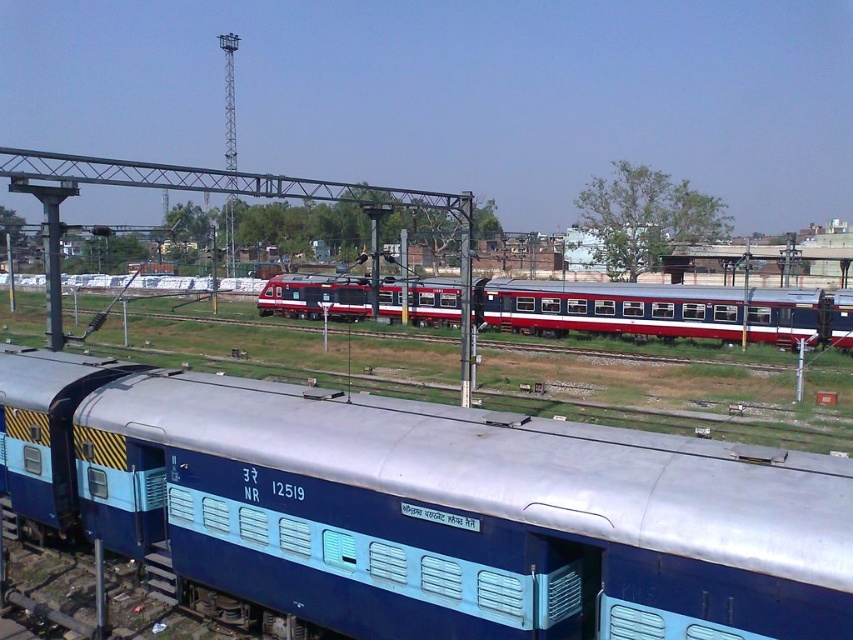
Question: Is blue metallic train car at lower left to the right of red glossy passenger train at center from the viewer's perspective?

Choices:
 (A) yes
 (B) no

Answer: (B)

Question: Does blue metallic train car at lower left come behind red glossy passenger train at center?

Choices:
 (A) yes
 (B) no

Answer: (B)

Question: Is blue metallic train car at lower left to the left of red glossy passenger train at center from the viewer's perspective?

Choices:
 (A) no
 (B) yes

Answer: (B)

Question: Which of the following is the closest to the observer?

Choices:
 (A) blue metallic train car at lower left
 (B) red glossy passenger train at center

Answer: (A)

Question: Which point appears closest to the camera in this image?

Choices:
 (A) (595, 307)
 (B) (456, 426)

Answer: (B)